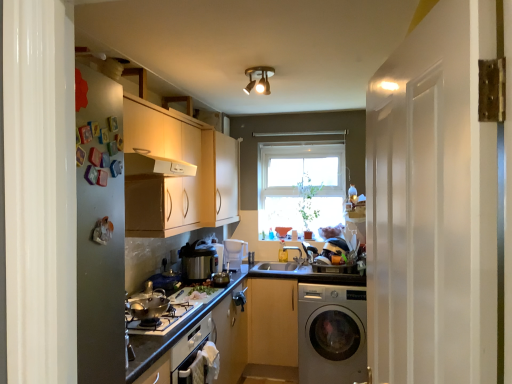
You are a GUI agent. You are given a task and a screenshot of the screen. Output one action in this format:
    pyautogui.click(x=<x>, y=<y>)
    Task: Click on the free space above light wood cabinet at center, arranged as the 1th cabinetry when viewed from the right (from a real-world perspective)
    This screenshot has width=512, height=384.
    Given the screenshot: What is the action you would take?
    pyautogui.click(x=277, y=265)